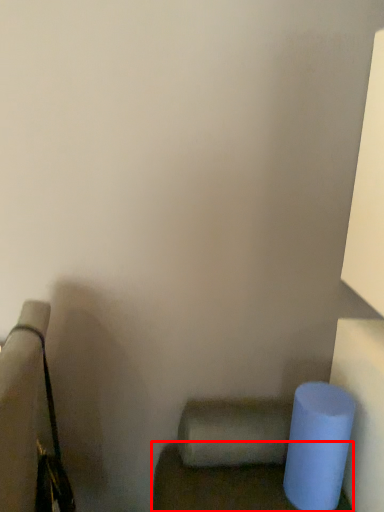
Question: Where is furniture (annotated by the red box) located in relation to toilet paper in the image?

Choices:
 (A) left
 (B) right

Answer: (B)